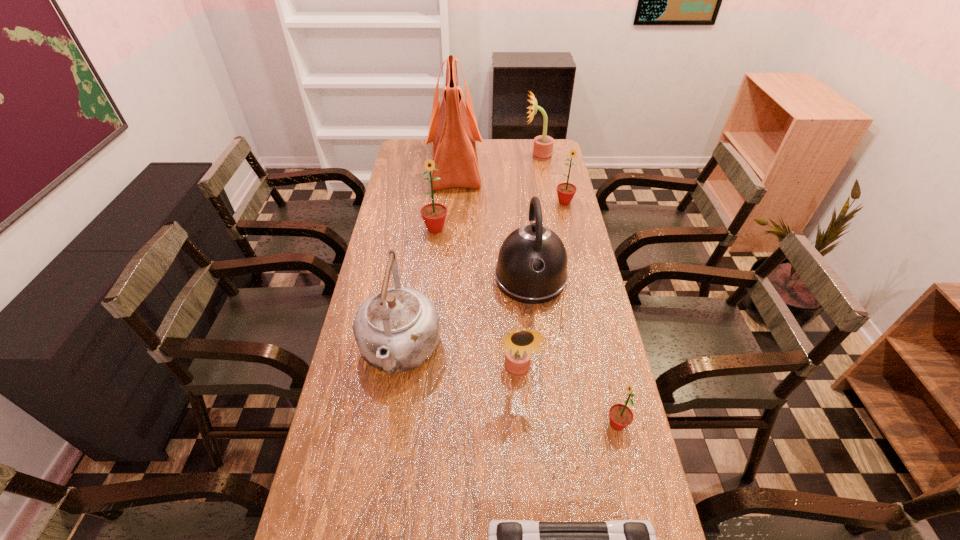
Find the location of a particular element. blank region between the eighth farthest object and the farther kettle is located at coordinates (574, 351).

Identify the location of blank region between the nearer kettle and the nearer yellow sunflower. This screenshot has width=960, height=540. (458, 361).

Identify the location of vacant space that is in between the shortest object and the fifth farthest object. (574, 351).

Where is `vacant area that lies between the brown shopping bag and the second sunflower from left to right`? The width and height of the screenshot is (960, 540). vacant area that lies between the brown shopping bag and the second sunflower from left to right is located at coordinates (487, 268).

Locate an element on the screen. The height and width of the screenshot is (540, 960). free space that is in between the shopping bag and the smaller yellow sunflower is located at coordinates (487, 268).

Identify the location of empty location between the bigger yellow sunflower and the second nearest green sunflower. The width and height of the screenshot is (960, 540). (487, 192).

Select which object appears as the closest to the second biggest green sunflower. Please provide its 2D coordinates. Your answer should be formatted as a tuple, i.e. [(x, y)], where the tuple contains the x and y coordinates of a point satisfying the conditions above.

[(543, 145)]

Choose which object is the eighth nearest neighbor to the tallest object. Please provide its 2D coordinates. Your answer should be formatted as a tuple, i.e. [(x, y)], where the tuple contains the x and y coordinates of a point satisfying the conditions above.

[(507, 539)]

Locate an element on the screen. The height and width of the screenshot is (540, 960). sunflower that is the second closest to the nearest object is located at coordinates (519, 344).

Locate which sunflower ranks third in proximity to the nearer kettle. Please provide its 2D coordinates. Your answer should be formatted as a tuple, i.e. [(x, y)], where the tuple contains the x and y coordinates of a point satisfying the conditions above.

[(620, 415)]